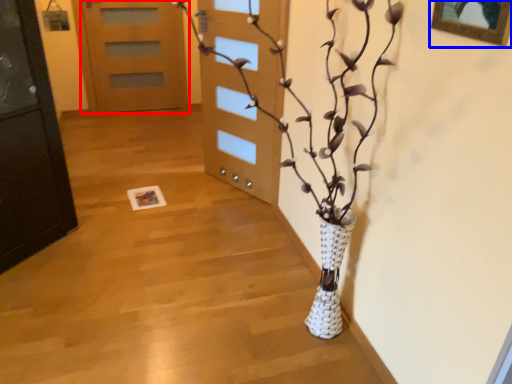
Question: Which of the following is the closest to the observer, door (highlighted by a red box) or picture frame (highlighted by a blue box)?

Choices:
 (A) door
 (B) picture frame

Answer: (B)